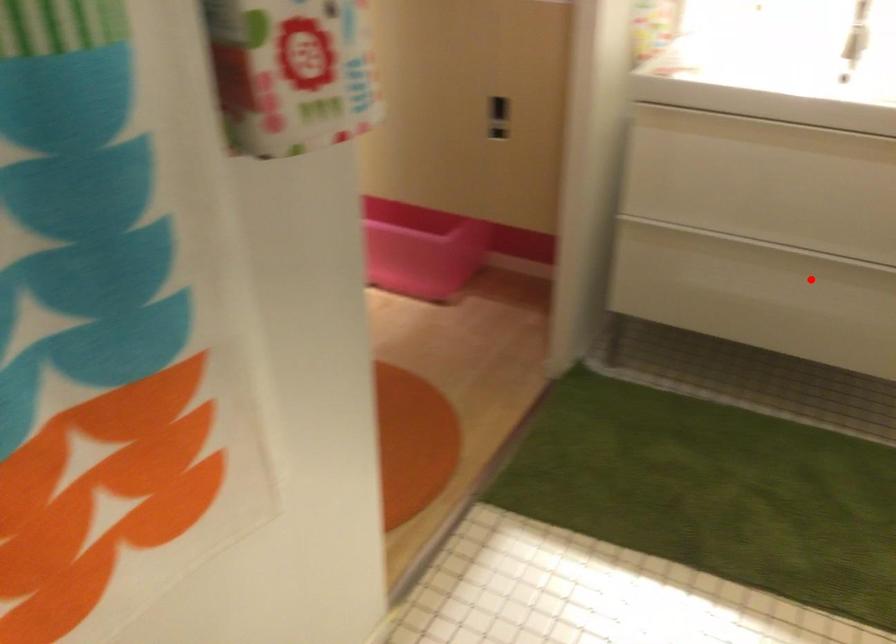
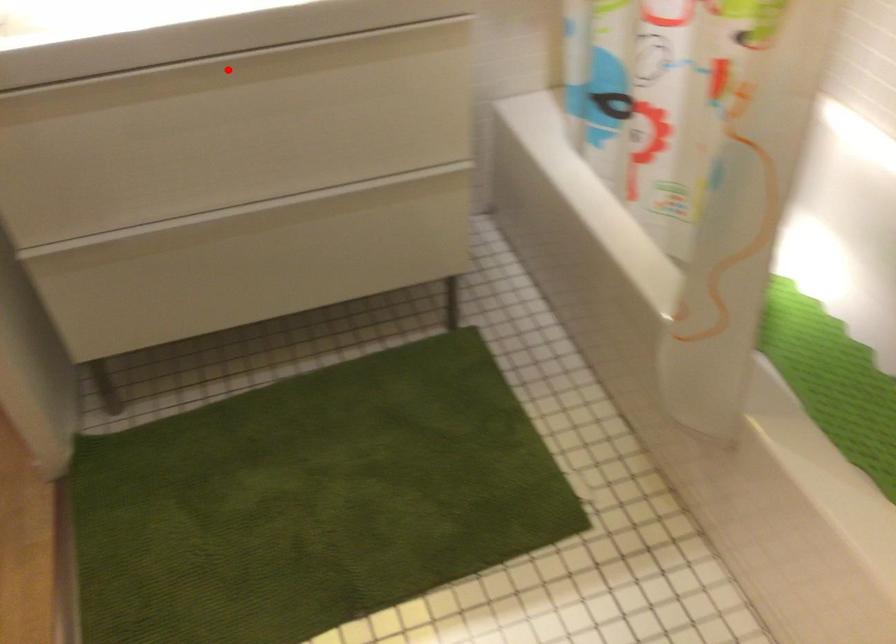
I am providing you with two images of the same scene from different viewpoints. A red point is marked on the first image and another point is marked on the second image. Is the marked point in image1 the same physical position as the marked point in image2?

No